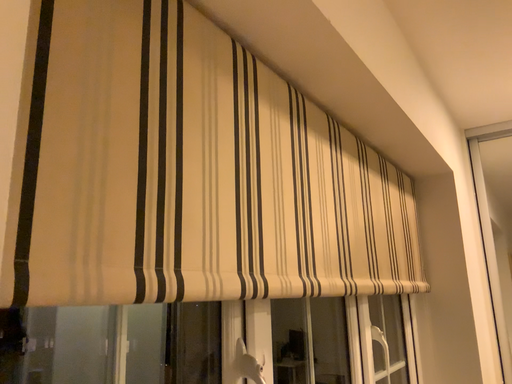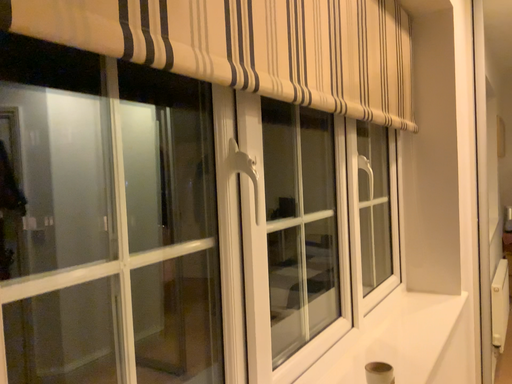
Question: How did the camera likely rotate when shooting the video?

Choices:
 (A) rotated downward
 (B) rotated upward

Answer: (A)